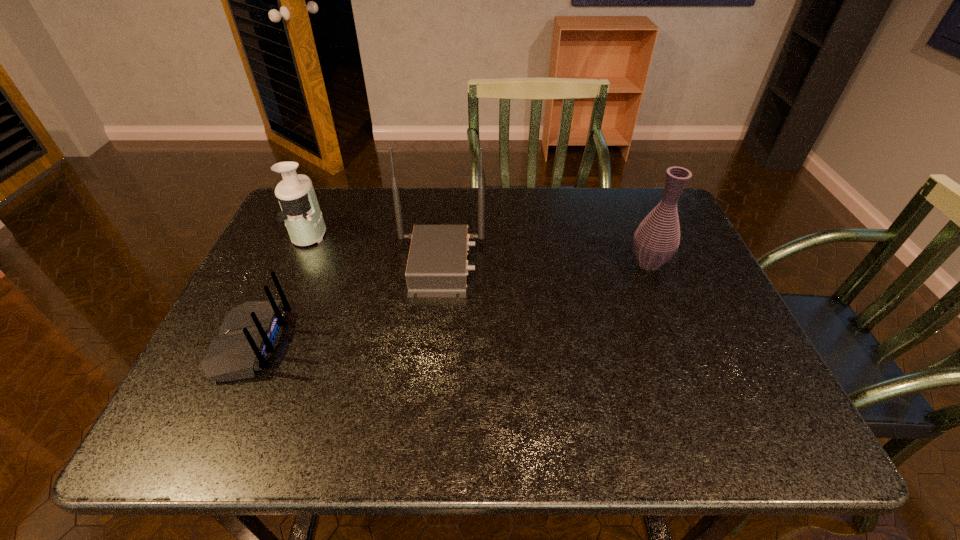
The image size is (960, 540). Identify the location of free spot that satisfies the following two spatial constraints: 1. on the front side of the juicer; 2. on the back of the shortest object. (261, 343).

Locate an element on the screen. vacant space that satisfies the following two spatial constraints: 1. on the front side of the juicer; 2. on the back of the shortest object is located at coordinates (261, 343).